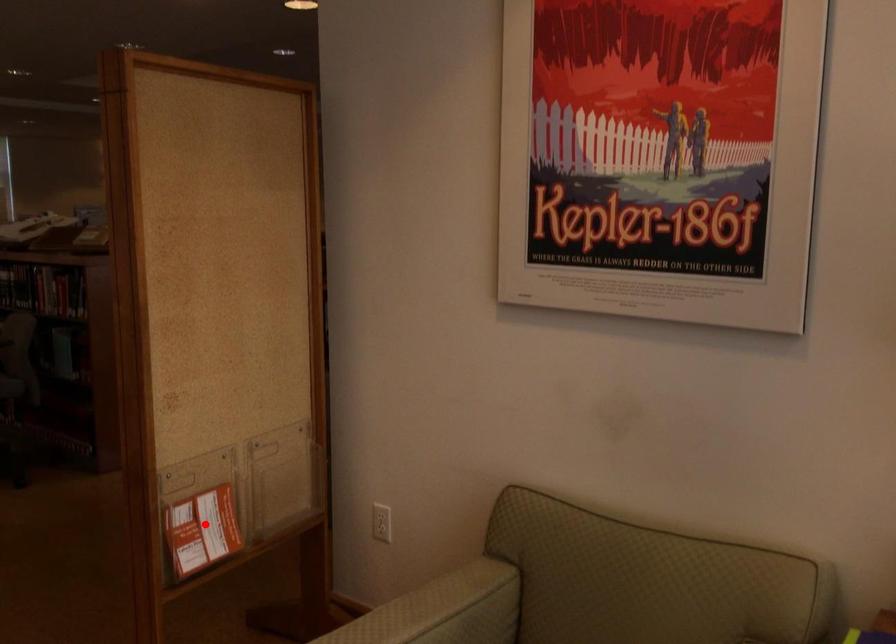
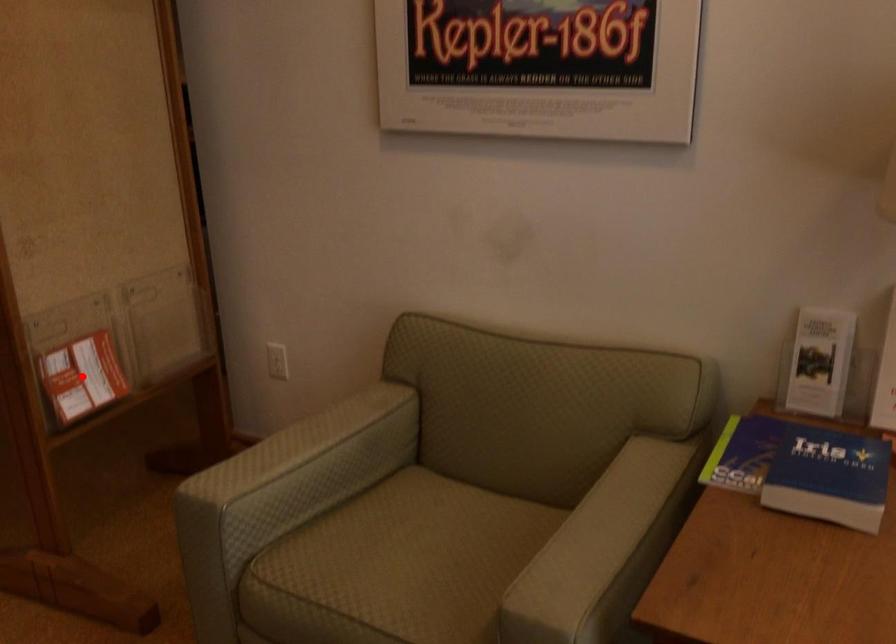
I am providing you with two images of the same scene from different viewpoints. A red point is marked on the first image and another point is marked on the second image. Is the red point in image1 aligned with the point shown in image2?

Yes